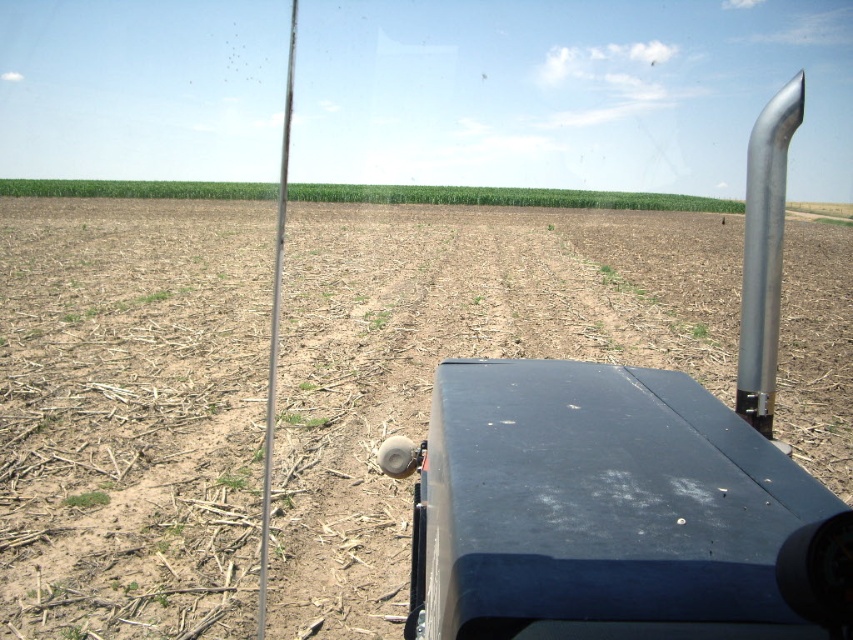
Measure the distance between point (x=309, y=252) and camera.

Point (x=309, y=252) and camera are 17.31 meters apart.

Does brown dirt field at center have a smaller size compared to metallic exhaust pipe at center right?

Actually, brown dirt field at center might be larger than metallic exhaust pipe at center right.

Does point (105, 385) come farther from viewer compared to point (466, 378)?

Yes, it is.

This screenshot has height=640, width=853. Identify the location of brown dirt field at center. (131, 413).